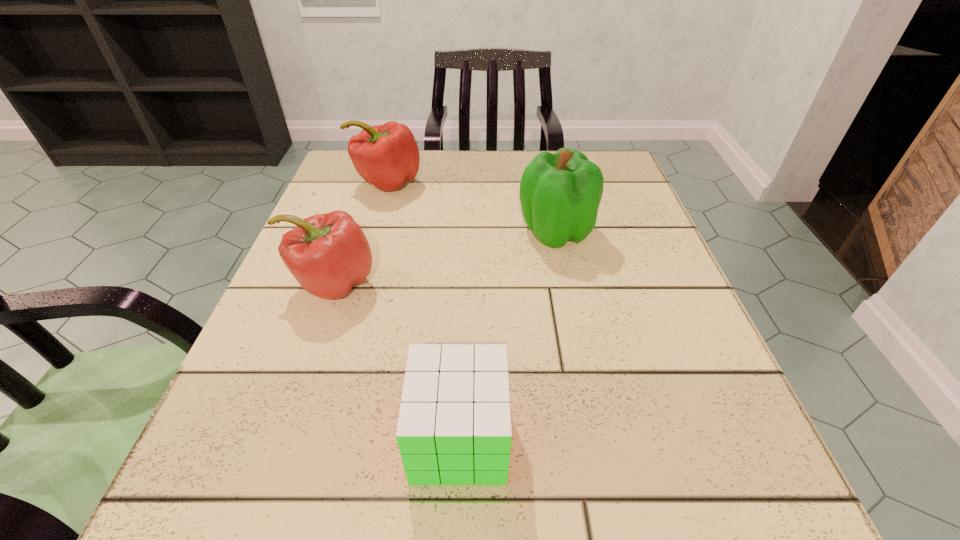
Identify the location of vacant space in between the second object from right to left and the farthest object. (423, 310).

Locate which object ranks third in proximity to the third farthest object. Please provide its 2D coordinates. Your answer should be formatted as a tuple, i.e. [(x, y)], where the tuple contains the x and y coordinates of a point satisfying the conditions above.

[(560, 194)]

I want to click on the closest object to the nearest object, so click(x=328, y=254).

Select which bell pepper appears as the second closest to the second object from right to left. Please provide its 2D coordinates. Your answer should be formatted as a tuple, i.e. [(x, y)], where the tuple contains the x and y coordinates of a point satisfying the conditions above.

[(560, 194)]

Where is `bell pepper that is the closest to the tallest object`? bell pepper that is the closest to the tallest object is located at coordinates (386, 156).